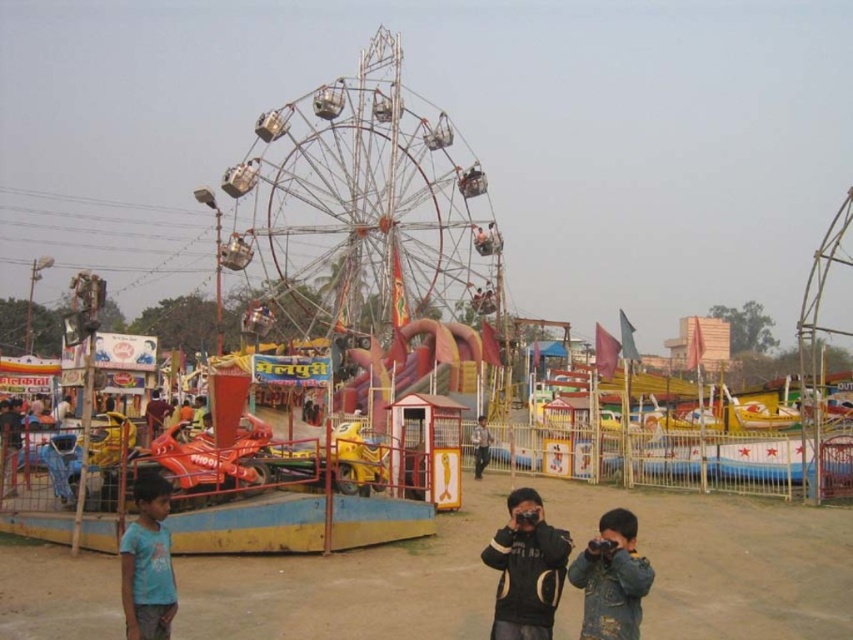
Question: Among these objects, which one is nearest to the camera?

Choices:
 (A) black matte jacket at center
 (B) denim jacket at lower right

Answer: (B)

Question: Considering the relative positions of metallic ferris wheel at center and blue cotton shirt at lower left in the image provided, where is metallic ferris wheel at center located with respect to blue cotton shirt at lower left?

Choices:
 (A) below
 (B) above

Answer: (B)

Question: Which point is farther to the camera?

Choices:
 (A) (273, 310)
 (B) (148, 580)

Answer: (A)

Question: Which point is closer to the camera?

Choices:
 (A) (463, 243)
 (B) (158, 625)
 (C) (473, 442)
 (D) (612, 556)

Answer: (B)

Question: Can you confirm if metallic ferris wheel at center is smaller than blue cotton shirt at lower left?

Choices:
 (A) no
 (B) yes

Answer: (A)

Question: Is blue cotton shirt at lower left thinner than light brown wooden pole at center?

Choices:
 (A) no
 (B) yes

Answer: (A)